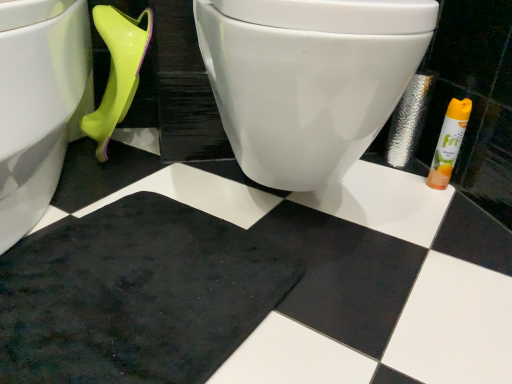
Question: From the image's perspective, relative to white glossy toilet at center, which is the 2th toilet from left to right, is white glossy toilet at lower left, which is the 1th toilet in left-to-right order, above or below?

Choices:
 (A) above
 (B) below

Answer: (B)

Question: Is white glossy toilet at lower left, which is the 1th toilet in left-to-right order, bigger or smaller than white glossy toilet at center, which is counted as the 1th toilet, starting from the right?

Choices:
 (A) small
 (B) big

Answer: (B)

Question: Estimate the real-world distances between objects in this image. Which object is farther from the white glossy toilet at center, which is counted as the 1th toilet, starting from the right?

Choices:
 (A) black rubber bath mat at lower left
 (B) white glossy toilet at lower left, which is the 1th toilet in left-to-right order
 (C) orange matte air freshener at right

Answer: (C)

Question: Which object is positioned closest to the black rubber bath mat at lower left?

Choices:
 (A) white glossy toilet at center, which is the 2th toilet from left to right
 (B) white glossy toilet at lower left, the second toilet in the right-to-left sequence
 (C) orange matte air freshener at right

Answer: (B)